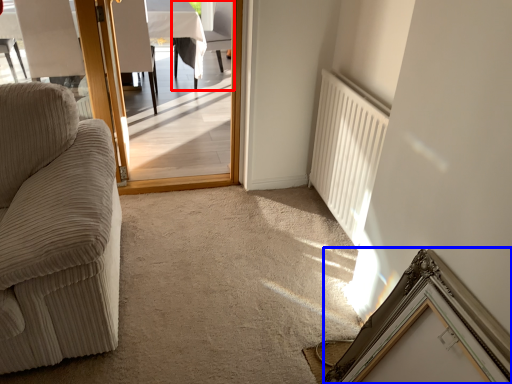
Question: Which object appears closest to the camera in this image, chair (highlighted by a red box) or picture frame (highlighted by a blue box)?

Choices:
 (A) chair
 (B) picture frame

Answer: (B)